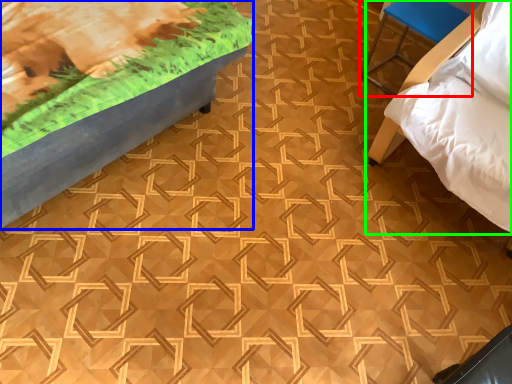
Question: Which object is positioned farthest from furniture (highlighted by a red box)? Select from furniture (highlighted by a blue box) and furniture (highlighted by a green box).

Choices:
 (A) furniture
 (B) furniture

Answer: (A)